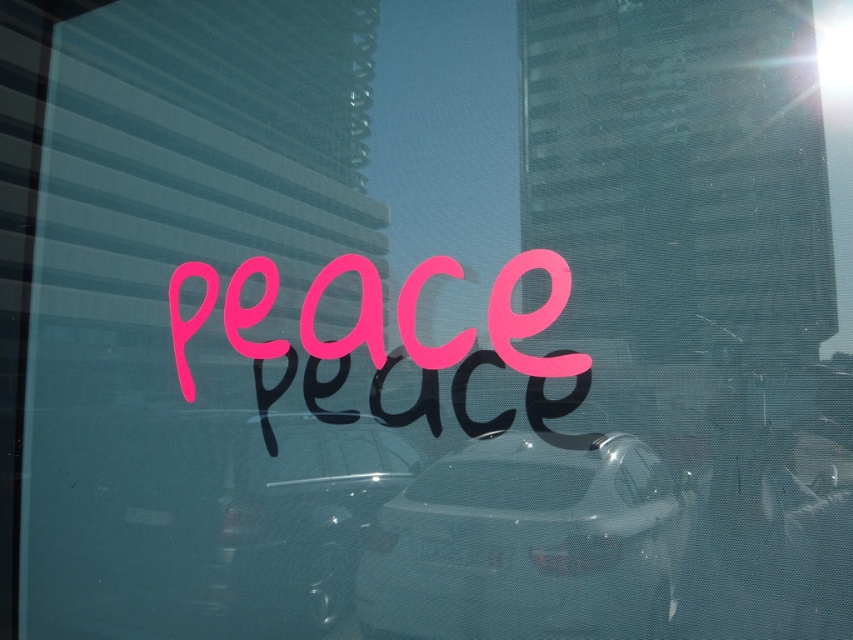
You are designing a parking layout and need to place a car that is 10 feet long between the satin silver car at center and the metallic silver car at center. Given their current positions, is there enough space between them to fit this car?

The satin silver car at center is only 8.30 inches away from the metallic silver car at center. Since 8.30 inches is much shorter than 10 feet, there is insufficient space to fit the 10 feet long car between them.

You are designing a poster and want to ensure that the metallic silver car at center and the pink matte text at center are balanced. Given their sizes, which object should you adjust to achieve better balance?

The metallic silver car at center occupies less space than the pink matte text at center, so you should enlarge the metallic silver car at center to balance the composition.

You are a delivery person trying to deliver a package to the address shown in the image. The address is written on the pink matte text at center. However, there is a satin silver car at center blocking the view of the text. Can you still read the address clearly?

The satin silver car at center is positioned on the right side of the pink matte text at center, so the car is only partially blocking the text. You may still be able to read the address on the pink matte text at center if the left side is visible.